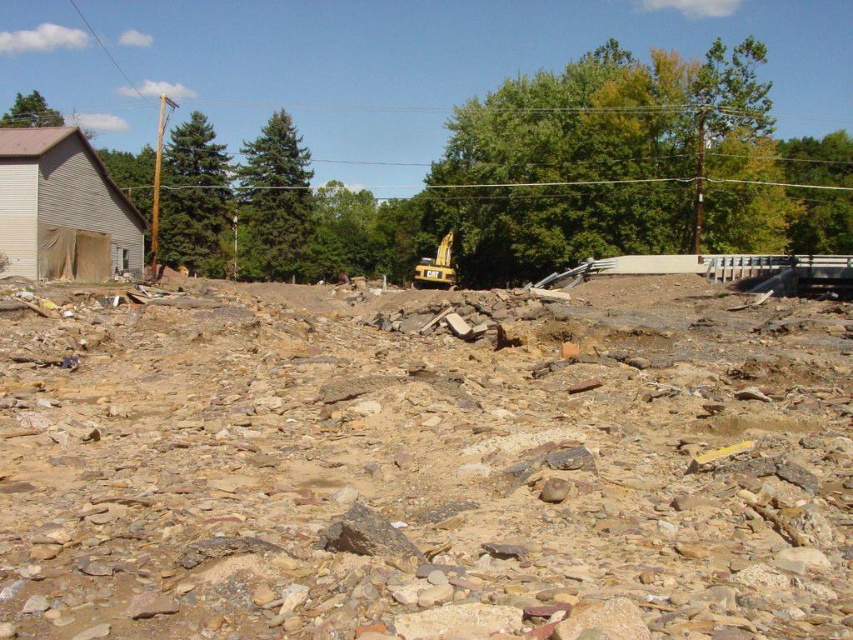
You are standing on the edge of a construction site and see the brown rocky debris at center and the yellow metallic excavator at center. Which object is nearer to you?

The brown rocky debris at center is closer to the viewer than the yellow metallic excavator at center.

You are a construction worker standing at the edge of the site. You need to move a heavy object from the brown rocky debris at center to the yellow metallic excavator at center. Which direction should you move it to ensure it reaches the excavator?

The brown rocky debris at center is to the left of the yellow metallic excavator at center, so you should move the heavy object to the right to reach the excavator.